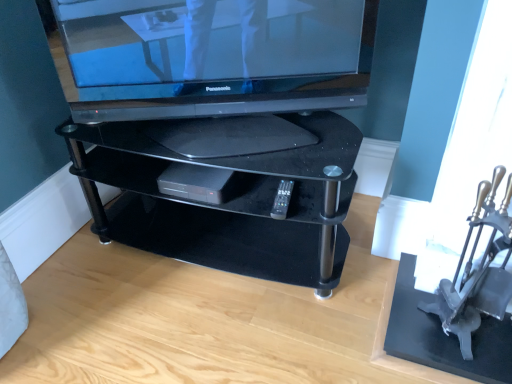
Question: Is black glass tv stand at center to the left of satin black television at upper center from the viewer's perspective?

Choices:
 (A) yes
 (B) no

Answer: (A)

Question: Considering the relative sizes of black glass tv stand at center and satin black television at upper center in the image provided, is black glass tv stand at center thinner than satin black television at upper center?

Choices:
 (A) yes
 (B) no

Answer: (B)

Question: Can you confirm if black glass tv stand at center is shorter than satin black television at upper center?

Choices:
 (A) no
 (B) yes

Answer: (A)

Question: Is black glass tv stand at center beside satin black television at upper center?

Choices:
 (A) yes
 (B) no

Answer: (B)

Question: Is satin black television at upper center located within black glass tv stand at center?

Choices:
 (A) no
 (B) yes

Answer: (A)

Question: Is point (182, 196) positioned closer to the camera than point (282, 203)?

Choices:
 (A) farther
 (B) closer

Answer: (A)

Question: Relative to black plastic remote at center, is black plastic dvd player at center in front or behind?

Choices:
 (A) behind
 (B) front

Answer: (A)

Question: Is black plastic dvd player at center bigger or smaller than black plastic remote at center?

Choices:
 (A) big
 (B) small

Answer: (A)

Question: Choose the correct answer: Is black plastic dvd player at center inside black plastic remote at center or outside it?

Choices:
 (A) inside
 (B) outside

Answer: (B)

Question: Would you say satin black television at upper center is to the left or to the right of black glass tv stand at center in the picture?

Choices:
 (A) right
 (B) left

Answer: (A)

Question: Does point (167, 61) appear closer or farther from the camera than point (105, 233)?

Choices:
 (A) closer
 (B) farther

Answer: (A)

Question: From the image's perspective, relative to black glass tv stand at center, is satin black television at upper center above or below?

Choices:
 (A) above
 (B) below

Answer: (A)

Question: Based on their sizes in the image, would you say satin black television at upper center is bigger or smaller than black glass tv stand at center?

Choices:
 (A) big
 (B) small

Answer: (B)

Question: From the image's perspective, is metallic silver armchair at right located above or below black plastic dvd player at center?

Choices:
 (A) below
 (B) above

Answer: (A)

Question: In the image, is metallic silver armchair at right on the left side or the right side of black plastic dvd player at center?

Choices:
 (A) left
 (B) right

Answer: (B)